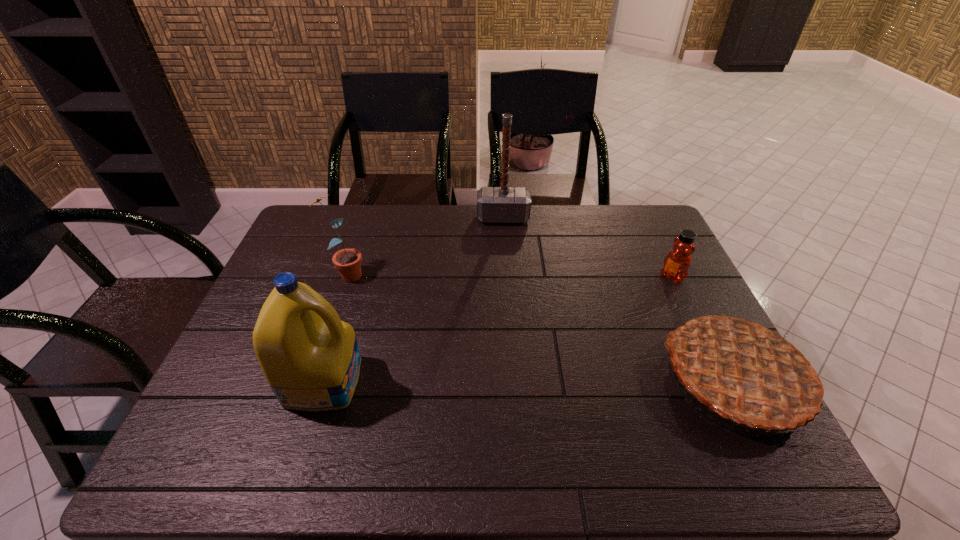
Identify the location of detergent. The image size is (960, 540). (310, 358).

Identify the location of pie. (747, 370).

Find the location of a particular element. The image size is (960, 540). hammer is located at coordinates (504, 204).

Identify the location of the third object from right to left. (504, 204).

You are a GUI agent. You are given a task and a screenshot of the screen. Output one action in this format:
    pyautogui.click(x=<x>, y=<y>)
    Task: Click on the shortest object
    This screenshot has width=960, height=540.
    Given the screenshot: What is the action you would take?
    677,262

Find the location of a particular element. This screenshot has height=540, width=960. sunflower is located at coordinates (348, 261).

This screenshot has height=540, width=960. Find the location of `blank area located on the label of the detergent`. blank area located on the label of the detergent is located at coordinates (518, 380).

Find the location of `blank space located 0.290m on the back of the pie`. blank space located 0.290m on the back of the pie is located at coordinates (673, 258).

Locate an element on the screen. vacant space located 0.130m on the striking surface of the hammer is located at coordinates (504, 250).

Where is `free spot located 0.140m on the striking surface of the hammer`? free spot located 0.140m on the striking surface of the hammer is located at coordinates (504, 252).